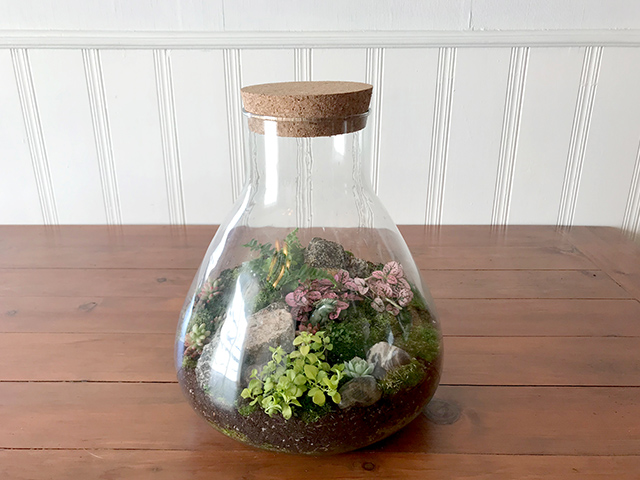
Locate an element on the screen. wooden table is located at coordinates (509, 412).